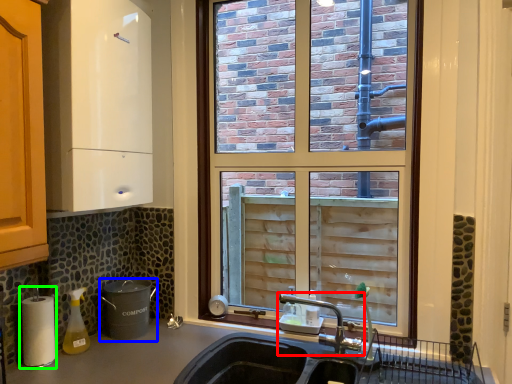
Question: Which object is the farthest from tap (highlighted by a red box)? Choose among these: appliance (highlighted by a blue box) or appliance (highlighted by a green box).

Choices:
 (A) appliance
 (B) appliance

Answer: (B)